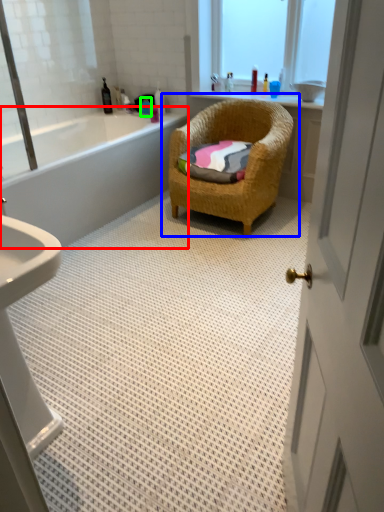
Question: Estimate the real-world distances between objects in this image. Which object is closer to bathtub (highlighted by a red box), chair (highlighted by a blue box) or toiletry (highlighted by a green box)?

Choices:
 (A) chair
 (B) toiletry

Answer: (A)